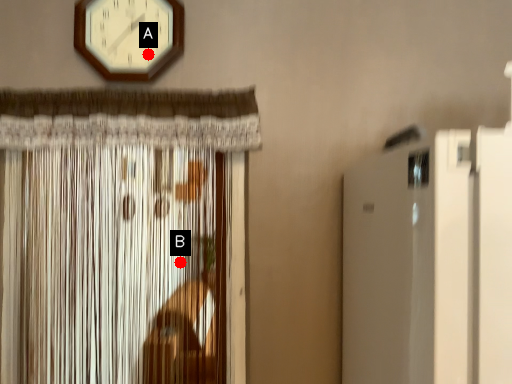
Question: Two points are circled on the image, labeled by A and B beside each circle. Which point is closer to the camera taking this photo?

Choices:
 (A) A is closer
 (B) B is closer

Answer: (A)